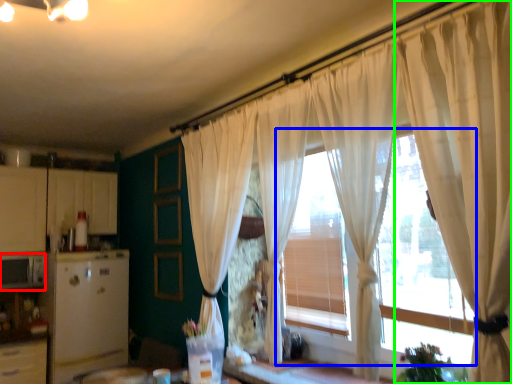
Question: Based on their relative distances, which object is farther from appliance (highlighted by a red box)? Choose from window frame (highlighted by a blue box) and curtain (highlighted by a green box).

Choices:
 (A) window frame
 (B) curtain

Answer: (B)